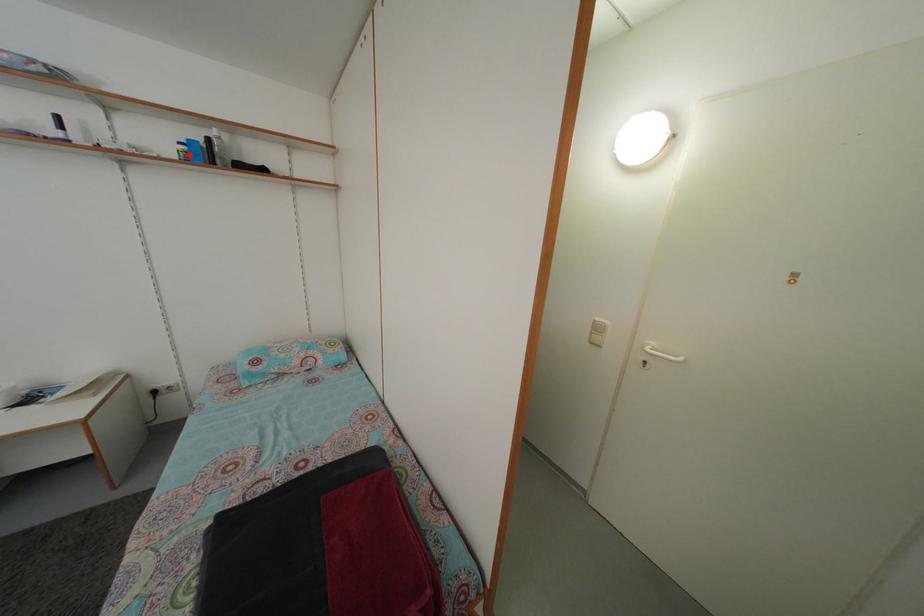
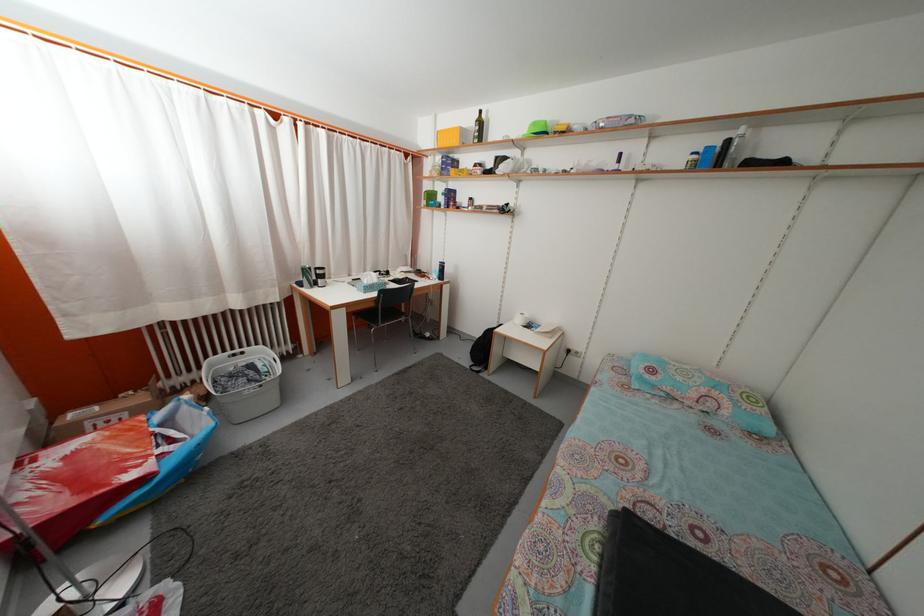
The point at the highlighted location is marked in the first image. Where is the corresponding point in the second image?

(699, 164)